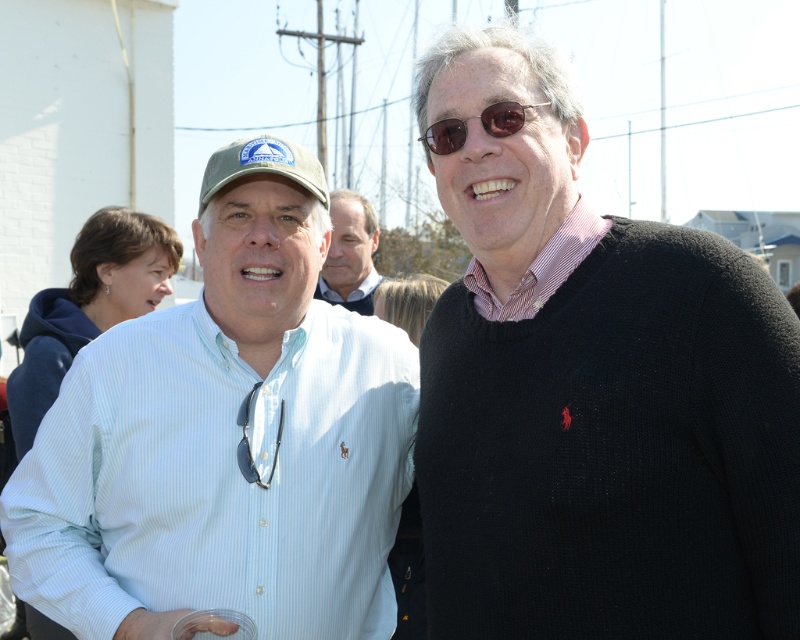
Between black sweater at right and blonde hair at upper center, which one appears on the right side from the viewer's perspective?

black sweater at right is more to the right.

Where is `black sweater at right`? The height and width of the screenshot is (640, 800). black sweater at right is located at coordinates (594, 394).

Where is `black sweater at right`? black sweater at right is located at coordinates (594, 394).

Can you confirm if light blue shirt at center is taller than green fabric baseball cap at upper center?

Indeed, light blue shirt at center has a greater height compared to green fabric baseball cap at upper center.

In the scene shown: Which is above, light blue shirt at center or green fabric baseball cap at upper center?

light blue shirt at center is above.

Who is more distant from viewer, (x=364, y=220) or (x=234, y=172)?

Point (x=364, y=220)

Find the location of a particular element. light blue shirt at center is located at coordinates [350, 253].

Can you confirm if light blue shirt at center is positioned above blonde hair at upper center?

Indeed, light blue shirt at center is positioned over blonde hair at upper center.

Locate an element on the screen. The height and width of the screenshot is (640, 800). light blue shirt at center is located at coordinates (350, 253).

You are a GUI agent. You are given a task and a screenshot of the screen. Output one action in this format:
    pyautogui.click(x=<x>, y=<y>)
    Task: Click on the light blue shirt at center
    The height and width of the screenshot is (640, 800).
    Given the screenshot: What is the action you would take?
    pyautogui.click(x=350, y=253)